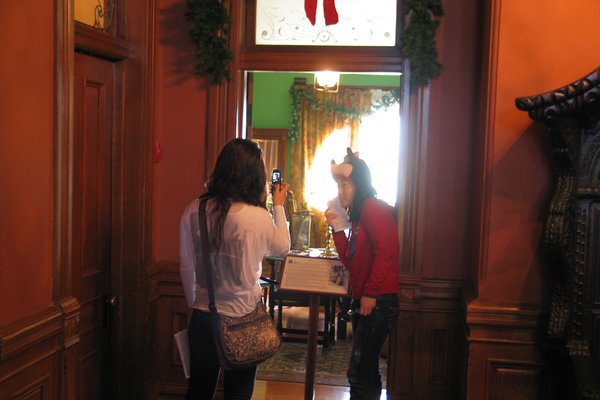
Locate an element on the screen. The image size is (600, 400). door is located at coordinates (92, 251).